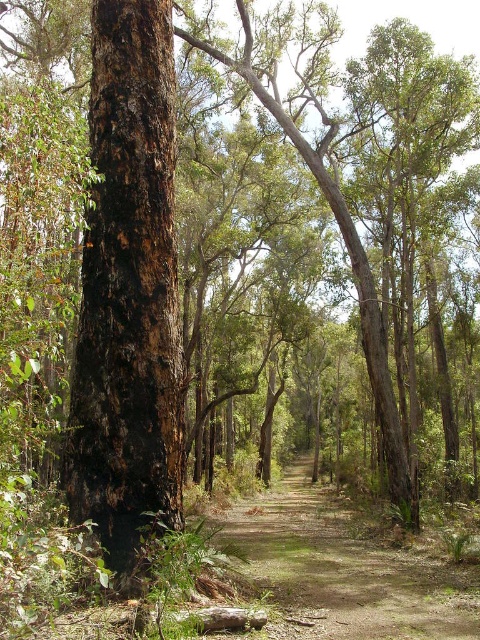
Question: Does dark brown bark tree at center have a lesser width compared to brown dirt track at center?

Choices:
 (A) yes
 (B) no

Answer: (A)

Question: Which point is closer to the camera?

Choices:
 (A) brown dirt track at center
 (B) dark brown bark tree at center

Answer: (A)

Question: Which point appears farthest from the camera in this image?

Choices:
 (A) (303, 636)
 (B) (158, 152)

Answer: (B)

Question: Can you confirm if dark brown bark tree at center is bigger than brown dirt track at center?

Choices:
 (A) yes
 (B) no

Answer: (B)

Question: Is dark brown bark tree at center wider than brown dirt track at center?

Choices:
 (A) yes
 (B) no

Answer: (B)